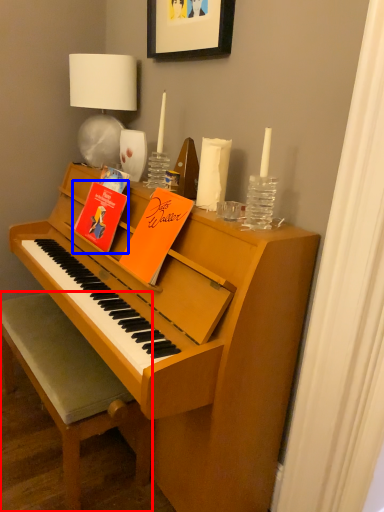
Question: Which object is further to the camera taking this photo, chair (highlighted by a red box) or paperback book (highlighted by a blue box)?

Choices:
 (A) chair
 (B) paperback book

Answer: (B)